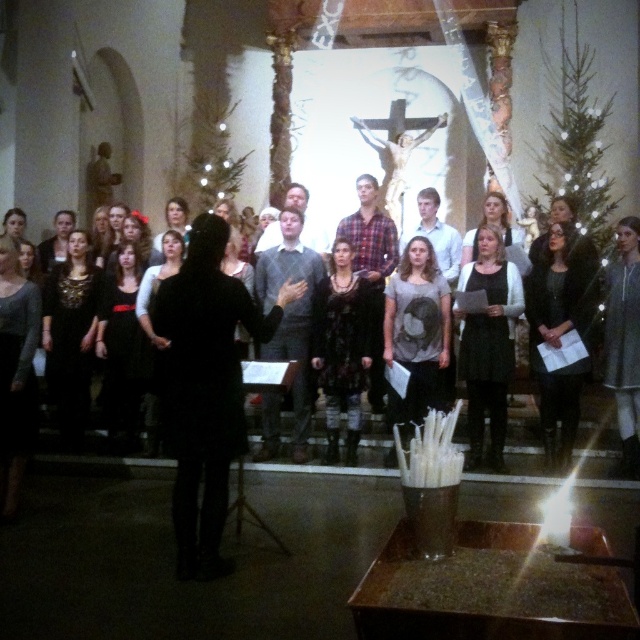
Question: Is dark textured dress at center below dark gray sweater at right?

Choices:
 (A) yes
 (B) no

Answer: (A)

Question: Can you confirm if black matte dress at center is bigger than dark gray sweater at right?

Choices:
 (A) yes
 (B) no

Answer: (A)

Question: Which is farther from the black dress at center?

Choices:
 (A) dark textured dress at center
 (B) black matte dress at center
 (C) dark gray sweater at right

Answer: (B)

Question: Which of the following is the closest to the observer?

Choices:
 (A) (230, 321)
 (B) (348, 420)
 (C) (611, 317)

Answer: (A)

Question: Among these objects, which one is nearest to the camera?

Choices:
 (A) dark textured dress at center
 (B) black dress at center

Answer: (B)

Question: Is black matte dress at center smaller than dark gray sweater at right?

Choices:
 (A) yes
 (B) no

Answer: (B)